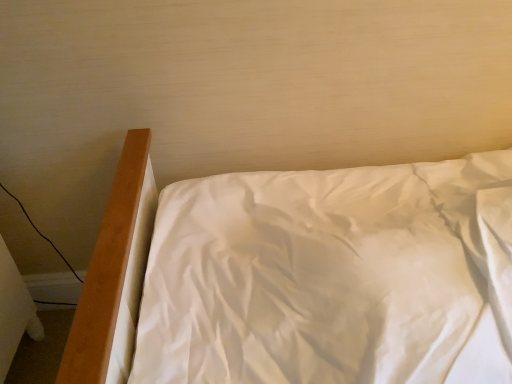
This screenshot has width=512, height=384. What are the coordinates of `white satin bed at center` in the screenshot? It's located at (300, 276).

In order to face white satin bed at center, should I rotate leftwards or rightwards?

Rotate right and turn 20.848 degrees.

The height and width of the screenshot is (384, 512). What do you see at coordinates (300, 276) in the screenshot?
I see `white satin bed at center` at bounding box center [300, 276].

What is the approximate height of white satin bed at center?

It is 98.70 centimeters.

Locate an element on the screen. The height and width of the screenshot is (384, 512). white satin bed at center is located at coordinates (300, 276).